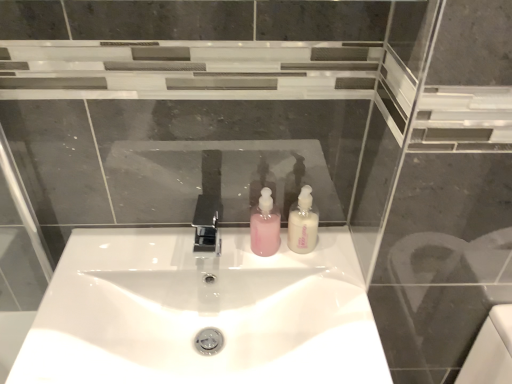
Locate an element on the screen. free space in front of white glossy soap dispenser at center, the 2th soap dispenser in the left-to-right sequence is located at coordinates (324, 299).